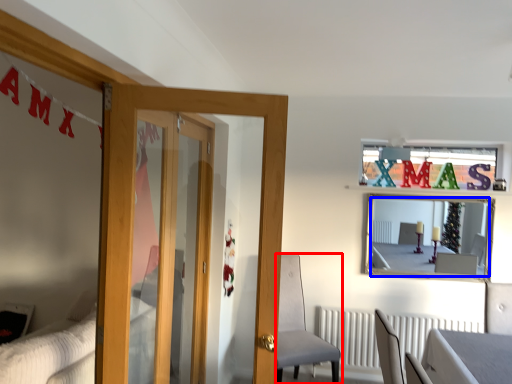
Question: Which object appears closest to the camera in this image, chair (highlighted by a red box) or mirror (highlighted by a blue box)?

Choices:
 (A) chair
 (B) mirror

Answer: (A)